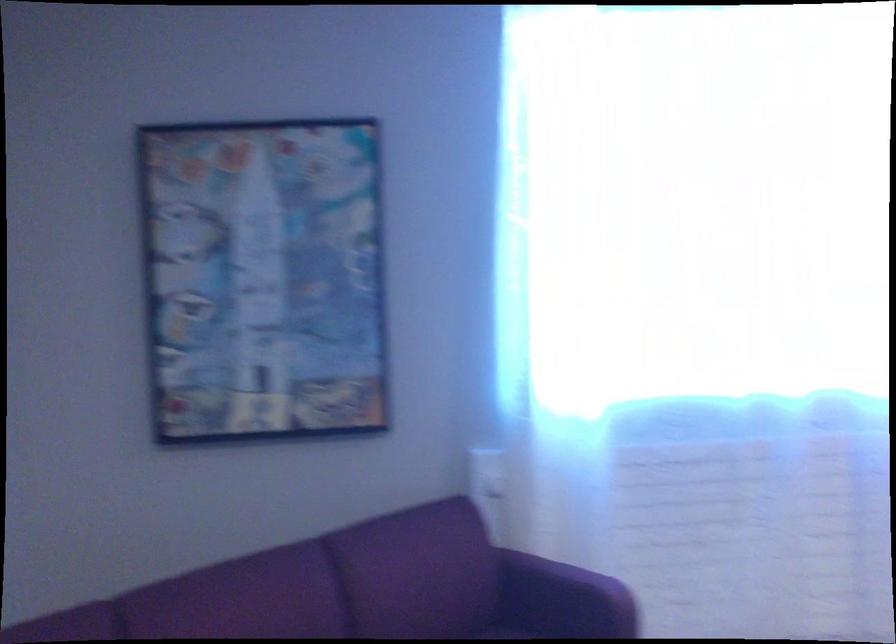
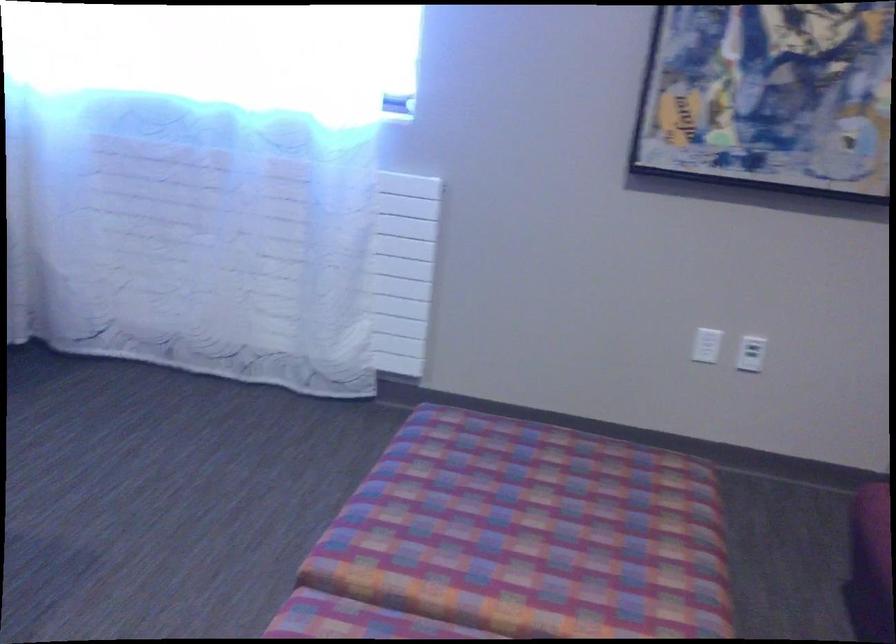
Question: Which direction would the cameraman need to move to produce the second image? Reply with the corresponding letter.

Choices:
 (A) Left
 (B) Right
 (C) Forward
 (D) Backward

Answer: (B)